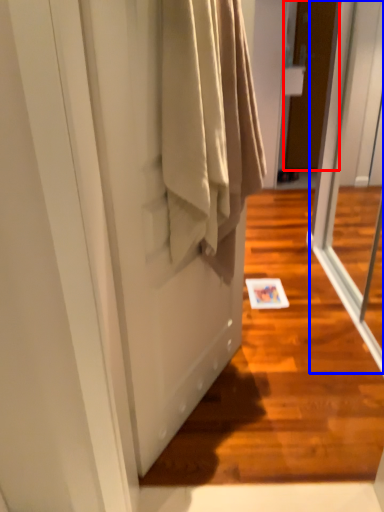
Question: Which object appears closest to the camera in this image, door (highlighted by a red box) or screen door (highlighted by a blue box)?

Choices:
 (A) door
 (B) screen door

Answer: (B)